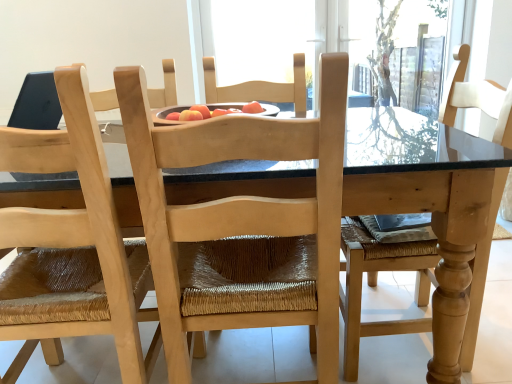
Question: Can you confirm if natural wood chair at center, which appears as the second chair when viewed from the left, is bigger than natural wood table at center?

Choices:
 (A) no
 (B) yes

Answer: (A)

Question: Is natural wood chair at center, which appears as the second chair when viewed from the left, further to the viewer compared to natural wood table at center?

Choices:
 (A) yes
 (B) no

Answer: (B)

Question: Is natural wood chair at center, which appears as the second chair when viewed from the left, looking in the opposite direction of natural wood table at center?

Choices:
 (A) yes
 (B) no

Answer: (A)

Question: From a real-world perspective, is natural wood chair at center, the first chair when ordered from right to left, physically above natural wood table at center?

Choices:
 (A) yes
 (B) no

Answer: (A)

Question: Is natural wood chair at center, the first chair when ordered from right to left, in contact with natural wood table at center?

Choices:
 (A) yes
 (B) no

Answer: (B)

Question: From the image's perspective, is natural wood table at center positioned above or below natural wood chair at center, which appears as the second chair when viewed from the left?

Choices:
 (A) above
 (B) below

Answer: (B)

Question: Considering the positions of natural wood table at center and natural wood chair at center, the first chair when ordered from right to left, in the image, is natural wood table at center taller or shorter than natural wood chair at center, the first chair when ordered from right to left,?

Choices:
 (A) tall
 (B) short

Answer: (B)

Question: Which is correct: natural wood table at center is inside natural wood chair at center, the first chair when ordered from right to left, or outside of it?

Choices:
 (A) outside
 (B) inside

Answer: (A)

Question: From a real-world perspective, is natural wood table at center above or below natural wood chair at center, the first chair when ordered from right to left?

Choices:
 (A) below
 (B) above

Answer: (A)

Question: Considering the positions of natural wood chair at center, which appears as the second chair when viewed from the left, and natural wood table at center in the image, is natural wood chair at center, which appears as the second chair when viewed from the left, bigger or smaller than natural wood table at center?

Choices:
 (A) small
 (B) big

Answer: (A)

Question: From a real-world perspective, is natural wood chair at center, the first chair when ordered from right to left, positioned above or below natural wood table at center?

Choices:
 (A) below
 (B) above

Answer: (B)

Question: From the image's perspective, is natural wood chair at center, the first chair when ordered from right to left, positioned above or below natural wood table at center?

Choices:
 (A) above
 (B) below

Answer: (A)

Question: Does point (317, 226) appear closer or farther from the camera than point (240, 349)?

Choices:
 (A) closer
 (B) farther

Answer: (A)

Question: Considering the positions of natural wood table at center and natural wood chair at center, which is the 1th chair in left-to-right order, in the image, is natural wood table at center wider or thinner than natural wood chair at center, which is the 1th chair in left-to-right order,?

Choices:
 (A) thin
 (B) wide

Answer: (B)

Question: Is point (305, 185) closer or farther from the camera than point (11, 236)?

Choices:
 (A) closer
 (B) farther

Answer: (B)